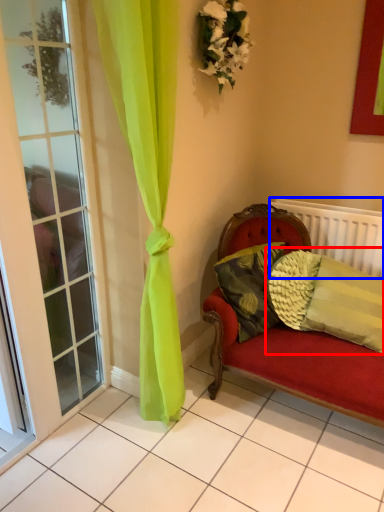
Question: Among these objects, which one is nearest to the camera, pillow (highlighted by a red box) or radiator (highlighted by a blue box)?

Choices:
 (A) pillow
 (B) radiator

Answer: (A)